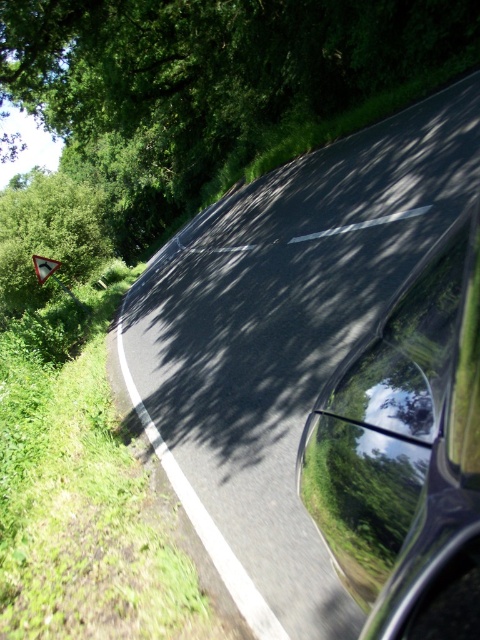
Who is lower down, white plastic triangle at left or metallic triangular sign at center?

white plastic triangle at left is below.

Image resolution: width=480 pixels, height=640 pixels. What are the coordinates of `white plastic triangle at left` in the screenshot? It's located at (52, 275).

What do you see at coordinates (400, 429) in the screenshot? I see `glossy black car window at center` at bounding box center [400, 429].

Can you confirm if glossy black car window at center is smaller than white plastic triangle at left?

Yes, glossy black car window at center is smaller than white plastic triangle at left.

Is point (382, 387) positioned after point (47, 259)?

No, (382, 387) is closer to viewer.

The height and width of the screenshot is (640, 480). In order to click on glossy black car window at center in this screenshot , I will do `click(400, 429)`.

Can you confirm if glossy black car window at center is taller than metallic triangular sign at center?

Indeed, glossy black car window at center has a greater height compared to metallic triangular sign at center.

This screenshot has height=640, width=480. What do you see at coordinates (400, 429) in the screenshot? I see `glossy black car window at center` at bounding box center [400, 429].

This screenshot has width=480, height=640. In order to click on glossy black car window at center in this screenshot , I will do `click(400, 429)`.